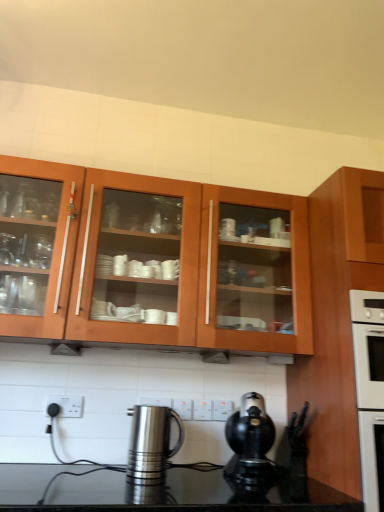
Question: Is white plastic electric outlet at center, which ranks as the 2th electric outlet in back-to-front order, with wooden cabinet at right, marked as the second cabinetry in a left-to-right arrangement?

Choices:
 (A) yes
 (B) no

Answer: (B)

Question: Is white plastic electric outlet at center, which ranks as the 2th electric outlet in back-to-front order, at the left side of wooden cabinet at right, marked as the second cabinetry in a left-to-right arrangement?

Choices:
 (A) yes
 (B) no

Answer: (A)

Question: Can you confirm if white plastic electric outlet at center, which ranks as the 2th electric outlet in back-to-front order, is taller than wooden cabinet at right, marked as the second cabinetry in a left-to-right arrangement?

Choices:
 (A) no
 (B) yes

Answer: (A)

Question: Considering the relative positions of white plastic electric outlet at center, the 2th electric outlet viewed from the front, and wooden cabinet at right, the first cabinetry from the right, in the image provided, is white plastic electric outlet at center, the 2th electric outlet viewed from the front, to the right of wooden cabinet at right, the first cabinetry from the right, from the viewer's perspective?

Choices:
 (A) no
 (B) yes

Answer: (A)

Question: Is white plastic electric outlet at center, the 2th electric outlet in the left-to-right sequence, outside of wooden cabinet at right, marked as the second cabinetry in a left-to-right arrangement?

Choices:
 (A) yes
 (B) no

Answer: (A)

Question: Considering the positions of polished stainless steel kettle at lower center, which appears as the 1th kitchen appliance when viewed from the left, and white plastic electric outlet at lower center, acting as the first electric outlet starting from the front, in the image, is polished stainless steel kettle at lower center, which appears as the 1th kitchen appliance when viewed from the left, bigger or smaller than white plastic electric outlet at lower center, acting as the first electric outlet starting from the front,?

Choices:
 (A) small
 (B) big

Answer: (B)

Question: Looking at their shapes, would you say polished stainless steel kettle at lower center, which appears as the 1th kitchen appliance when viewed from the left, is wider or thinner than white plastic electric outlet at lower center, which is the 3th electric outlet from back to front?

Choices:
 (A) wide
 (B) thin

Answer: (A)

Question: From their relative heights in the image, would you say polished stainless steel kettle at lower center, which appears as the 1th kitchen appliance when viewed from the left, is taller or shorter than white plastic electric outlet at lower center, which is the third electric outlet in right-to-left order?

Choices:
 (A) short
 (B) tall

Answer: (B)

Question: From a real-world perspective, is polished stainless steel kettle at lower center, which appears as the 1th kitchen appliance when viewed from the left, above or below white plastic electric outlet at lower center, which is the 3th electric outlet from back to front?

Choices:
 (A) below
 (B) above

Answer: (A)

Question: Considering the positions of black plastic coffee maker at lower center, placed as the first kitchen appliance when sorted from right to left, and white plastic electric outlet at lower center, marked as the first electric outlet in a left-to-right arrangement, in the image, is black plastic coffee maker at lower center, placed as the first kitchen appliance when sorted from right to left, taller or shorter than white plastic electric outlet at lower center, marked as the first electric outlet in a left-to-right arrangement,?

Choices:
 (A) tall
 (B) short

Answer: (A)

Question: Looking at the image, does black plastic coffee maker at lower center, placed as the first kitchen appliance when sorted from right to left, seem bigger or smaller compared to white plastic electric outlet at lower center, acting as the first electric outlet starting from the front?

Choices:
 (A) big
 (B) small

Answer: (A)

Question: Considering the positions of black plastic coffee maker at lower center, which ranks as the 2th kitchen appliance in left-to-right order, and white plastic electric outlet at lower center, which is the third electric outlet in right-to-left order, in the image, is black plastic coffee maker at lower center, which ranks as the 2th kitchen appliance in left-to-right order, wider or thinner than white plastic electric outlet at lower center, which is the third electric outlet in right-to-left order,?

Choices:
 (A) thin
 (B) wide

Answer: (B)

Question: Based on their positions, is black plastic coffee maker at lower center, placed as the first kitchen appliance when sorted from right to left, located to the left or right of white plastic electric outlet at lower center, marked as the first electric outlet in a left-to-right arrangement?

Choices:
 (A) left
 (B) right

Answer: (B)

Question: From a real-world perspective, is white plastic electric outlet at center, which ranks as the 2th electric outlet in back-to-front order, positioned above or below wooden cabinet at upper center, which ranks as the second cabinetry in right-to-left order?

Choices:
 (A) below
 (B) above

Answer: (A)

Question: In the image, is white plastic electric outlet at center, the 2th electric outlet in the left-to-right sequence, positioned in front of or behind wooden cabinet at upper center, arranged as the 1th cabinetry when viewed from the left?

Choices:
 (A) behind
 (B) front

Answer: (A)